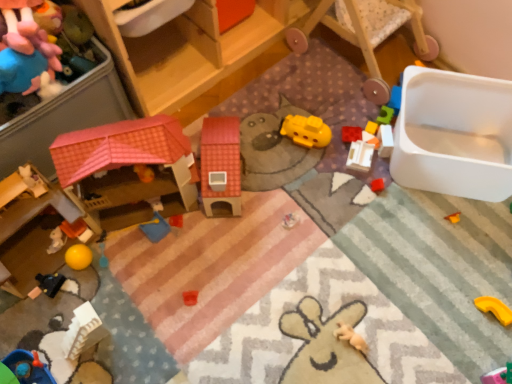
Image resolution: width=512 pixels, height=384 pixels. Find the location of `vacant space that is in between yellow matte block at upper right, positioned as the 3th toy in right-to-left order, and yellow matte submarine at center, which is the 5th toy in left-to-right order`. vacant space that is in between yellow matte block at upper right, positioned as the 3th toy in right-to-left order, and yellow matte submarine at center, which is the 5th toy in left-to-right order is located at coordinates (346, 135).